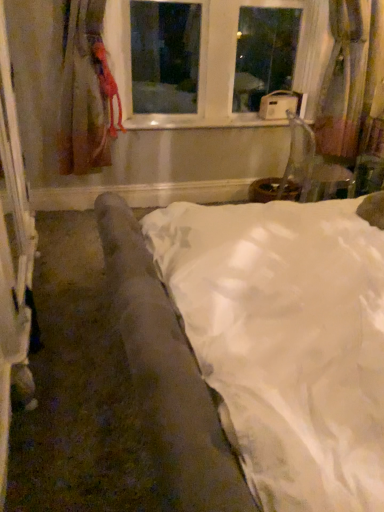
At what (x,y) coordinates should I click in order to perform the action: click on free location above white glossy window sill at center (from a real-world perspective). Please return your answer as a coordinate pair (x, y). This screenshot has height=512, width=384. Looking at the image, I should click on (204, 121).